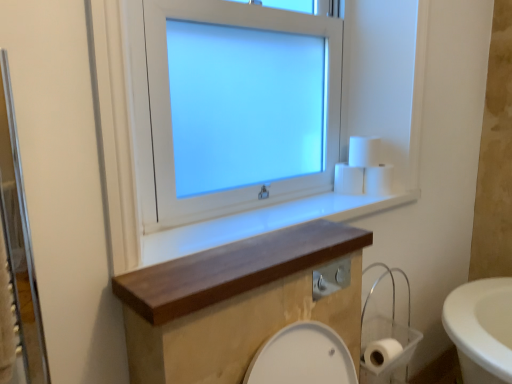
Question: Would you say wooden shelf at center is outside wooden at upper center?

Choices:
 (A) yes
 (B) no

Answer: (A)

Question: Can you confirm if wooden shelf at center is shorter than wooden at upper center?

Choices:
 (A) yes
 (B) no

Answer: (B)

Question: From a real-world perspective, is wooden shelf at center below wooden at upper center?

Choices:
 (A) no
 (B) yes

Answer: (B)

Question: From the image's perspective, does wooden shelf at center appear lower than wooden at upper center?

Choices:
 (A) yes
 (B) no

Answer: (A)

Question: Is wooden at upper center surrounded by wooden shelf at center?

Choices:
 (A) no
 (B) yes

Answer: (A)

Question: From a real-world perspective, is white matte toilet paper at lower right, the first toilet paper positioned from the bottom, positioned above or below white matte toilet paper at upper right, positioned as the 4th toilet paper in bottom-to-top order?

Choices:
 (A) below
 (B) above

Answer: (A)

Question: Is white matte toilet paper at lower right, the first toilet paper positioned from the bottom, taller or shorter than white matte toilet paper at upper right, the 1th toilet paper viewed from the top?

Choices:
 (A) short
 (B) tall

Answer: (A)

Question: Based on their sizes in the image, would you say white matte toilet paper at lower right, the first toilet paper positioned from the bottom, is bigger or smaller than white matte toilet paper at upper right, positioned as the 4th toilet paper in bottom-to-top order?

Choices:
 (A) small
 (B) big

Answer: (B)

Question: Considering their positions, is white matte toilet paper at lower right, acting as the 4th toilet paper starting from the top, located in front of or behind white matte toilet paper at upper right, the 1th toilet paper viewed from the top?

Choices:
 (A) front
 (B) behind

Answer: (A)

Question: Is point (360, 145) closer or farther from the camera than point (399, 345)?

Choices:
 (A) closer
 (B) farther

Answer: (B)

Question: Considering the positions of white matte toilet paper at upper right, the 1th toilet paper viewed from the top, and white matte toilet paper at lower right, the first toilet paper positioned from the bottom, in the image, is white matte toilet paper at upper right, the 1th toilet paper viewed from the top, wider or thinner than white matte toilet paper at lower right, the first toilet paper positioned from the bottom,?

Choices:
 (A) wide
 (B) thin

Answer: (B)

Question: Is white matte toilet paper at upper right, positioned as the 4th toilet paper in bottom-to-top order, inside the boundaries of white matte toilet paper at lower right, the first toilet paper positioned from the bottom, or outside?

Choices:
 (A) outside
 (B) inside

Answer: (A)

Question: Is white matte toilet paper at upper right, the 1th toilet paper viewed from the top, in front of or behind white matte toilet paper at lower right, acting as the 4th toilet paper starting from the top, in the image?

Choices:
 (A) front
 (B) behind

Answer: (B)

Question: Considering their positions, is wooden shelf at center located in front of or behind white glossy window at upper center?

Choices:
 (A) front
 (B) behind

Answer: (A)

Question: Is wooden shelf at center bigger or smaller than white glossy window at upper center?

Choices:
 (A) big
 (B) small

Answer: (B)